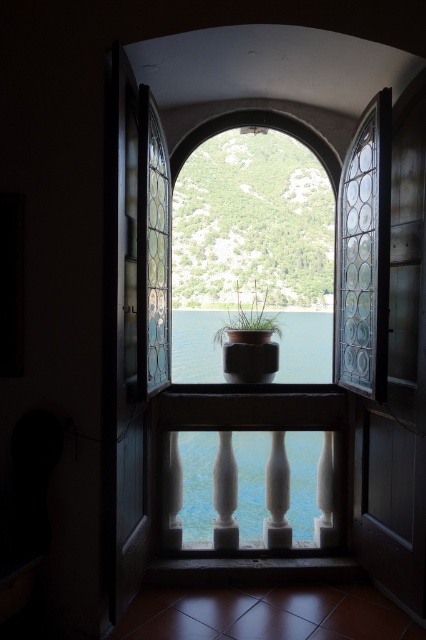
Can you confirm if blue glass water at center is taller than green matte pot at center?

Yes, blue glass water at center is taller than green matte pot at center.

Can you confirm if blue glass water at center is smaller than green matte pot at center?

No, blue glass water at center is not smaller than green matte pot at center.

Identify the location of blue glass water at center. (305, 346).